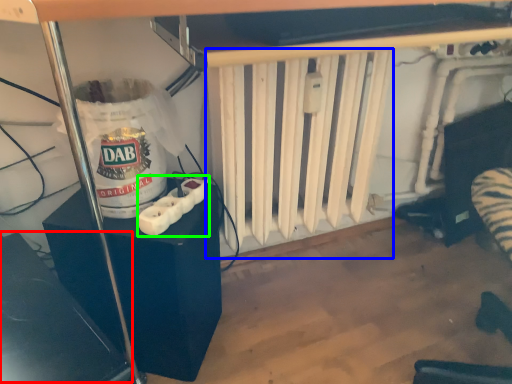
Question: Considering the real-world distances, which object is farthest from wide (highlighted by a red box)? radiator (highlighted by a blue box) or Wii controller (highlighted by a green box)?

Choices:
 (A) radiator
 (B) Wii controller

Answer: (A)